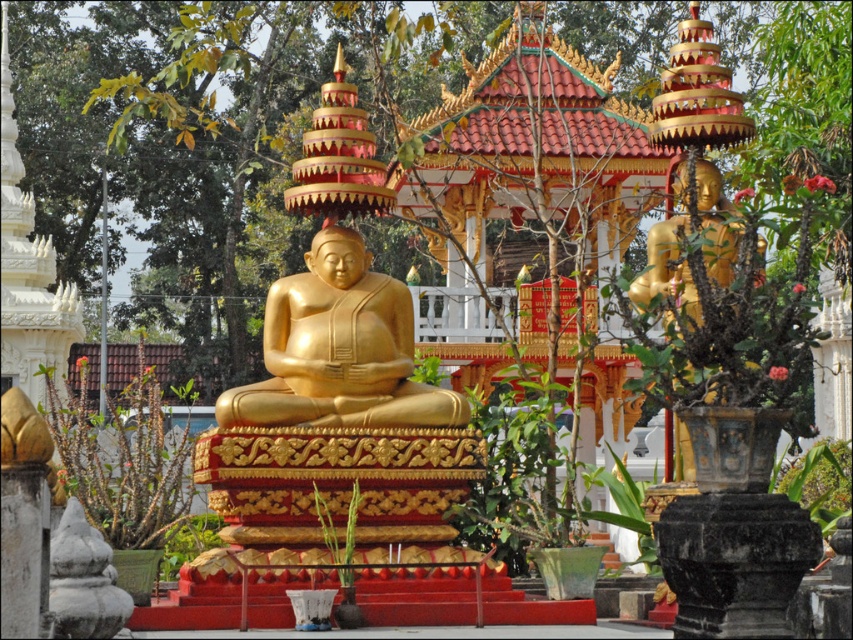
You are standing in front of the Buddhist temple scene described. You want to locate the gold polished statue at center. Based on the coordinates provided, where exactly would you look to find it?

The gold polished statue at center is located at the coordinates point (339, 349).

You are standing at the point marked as point (339,349) in the temple scene. What object is directly in front of you?

The gold polished statue at center is directly in front of you at point (339,349).